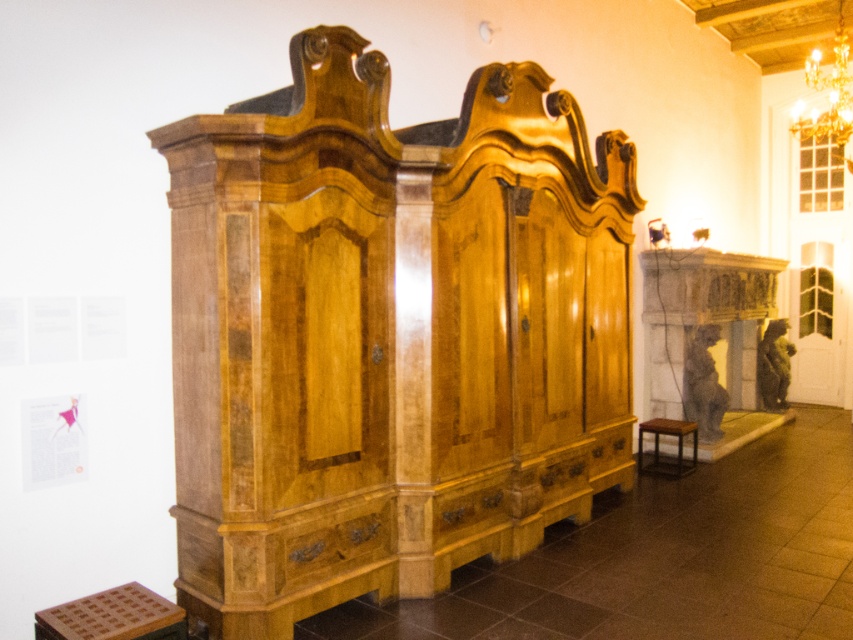
Question: Can you confirm if glossy wood dresser at center is positioned to the right of shiny brown wood drawer at lower center?

Choices:
 (A) yes
 (B) no

Answer: (A)

Question: From the image, what is the correct spatial relationship of glossy wood dresser at center in relation to shiny brown wood drawer at lower center?

Choices:
 (A) below
 (B) above

Answer: (B)

Question: Which of these objects is positioned farthest from the brown wooden stool at lower right?

Choices:
 (A) shiny brown wood drawer at lower center
 (B) glossy wood dresser at center

Answer: (A)

Question: Among these objects, which one is nearest to the camera?

Choices:
 (A) brown wooden stool at lower right
 (B) glossy wood dresser at center
 (C) shiny brown wood drawer at lower center

Answer: (B)

Question: Among these objects, which one is farthest from the camera?

Choices:
 (A) brown wooden stool at lower right
 (B) shiny brown wood drawer at lower center

Answer: (A)

Question: Is glossy wood dresser at center above brown wooden stool at lower right?

Choices:
 (A) yes
 (B) no

Answer: (A)